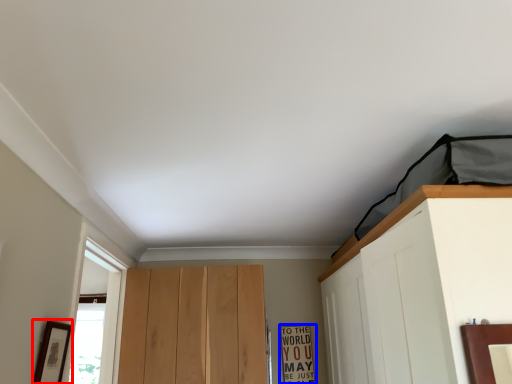
Question: Which point is closer to the camera, picture frame (highlighted by a red box) or warning sign (highlighted by a blue box)?

Choices:
 (A) picture frame
 (B) warning sign

Answer: (A)